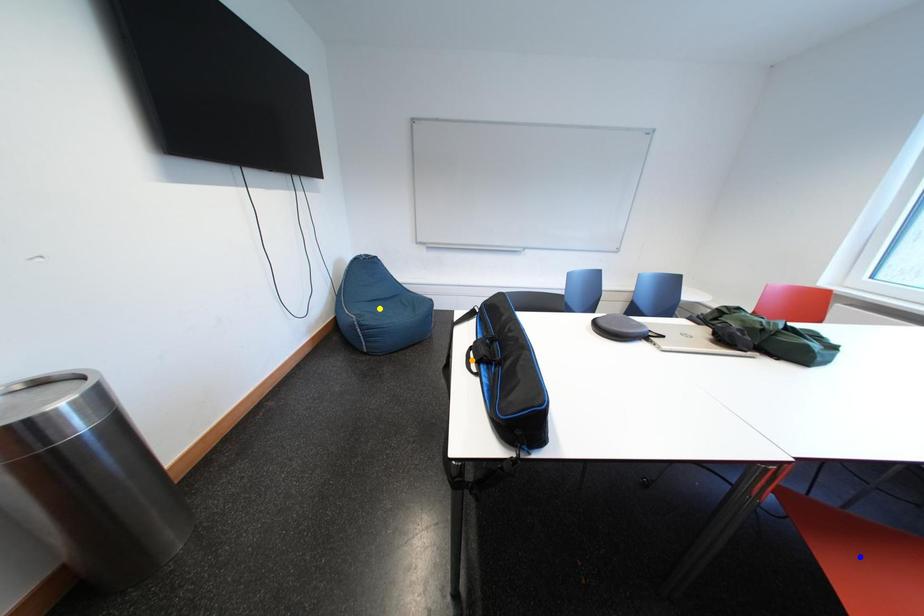
Order these from nearest to farthest:
- yellow point
- orange point
- blue point

yellow point
orange point
blue point